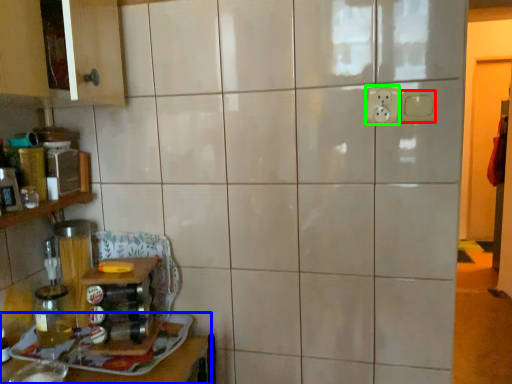
Question: Which object is positioned farthest from electric outlet (highlighted by a red box)? Select from furniture (highlighted by a blue box) and electric outlet (highlighted by a green box).

Choices:
 (A) furniture
 (B) electric outlet

Answer: (A)